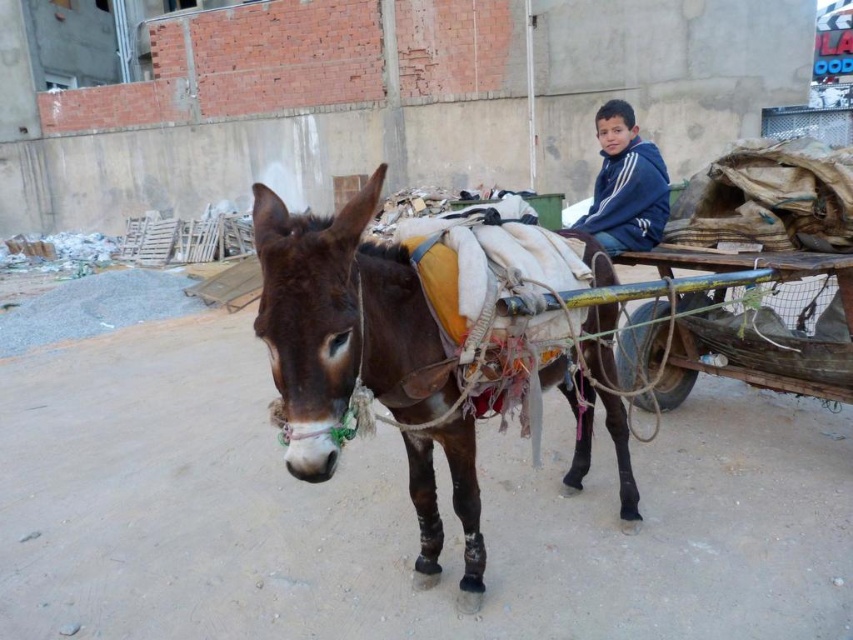
Between brown leather donkey at center and blue fleece jacket at upper center, which one has less height?

blue fleece jacket at upper center is shorter.

In the scene shown: Does brown leather donkey at center have a larger size compared to blue fleece jacket at upper center?

Yes.

You are a GUI agent. You are given a task and a screenshot of the screen. Output one action in this format:
    pyautogui.click(x=<x>, y=<y>)
    Task: Click on the brown leather donkey at center
    Image resolution: width=853 pixels, height=640 pixels.
    Given the screenshot: What is the action you would take?
    pyautogui.click(x=335, y=305)

Identify the location of brown leather donkey at center. This screenshot has width=853, height=640. (335, 305).

Between point (461, 586) and point (664, 332), which one is positioned in front?

Point (461, 586)

Is brown leather donkey at center further to the viewer compared to wooden cart at center?

No.

Between point (282, 248) and point (843, 353), which one is positioned in front?

Point (282, 248) is in front.

Where is `brown leather donkey at center`? This screenshot has width=853, height=640. brown leather donkey at center is located at coordinates (335, 305).

Is wooden cart at center positioned behind blue fleece jacket at upper center?

That is False.

Between point (776, 264) and point (611, 164), which one is positioned behind?

The point (611, 164) is more distant.

Locate an element on the screen. The image size is (853, 640). wooden cart at center is located at coordinates (733, 360).

Where is `wooden cart at center`? The height and width of the screenshot is (640, 853). wooden cart at center is located at coordinates (733, 360).